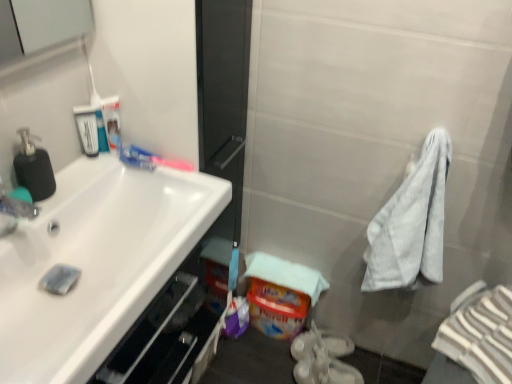
The width and height of the screenshot is (512, 384). In order to click on vacant region in front of clear plastic bottle at upper left, marked as the second mouthwash in a left-to-right arrangement in this screenshot , I will do `click(90, 174)`.